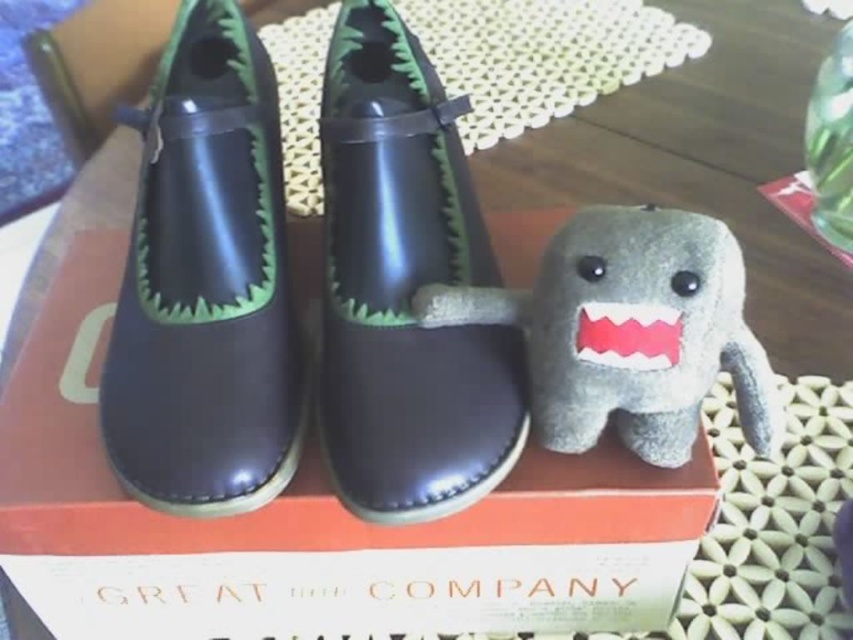
You are taking a photo of the scene and want to focus on both the point at point (264, 428) and the point at point (613, 212). Which point is closer to your camera?

Point (264, 428) is further to the camera than point (613, 212), so the point at point (613, 212) is closer to the camera.

You are organizing a display for a toy store and need to place the shiny black shoe at center and the gray plush toy at center on a shelf. The shelf has limited space, and you want to ensure both items fit without overlapping. Given their sizes, which item should be placed first to maximize space efficiency?

The shiny black shoe at center is larger than the gray plush toy at center. To maximize space efficiency, place the shiny black shoe at center first, then position the gray plush toy at center next to it.

You are standing at the origin of the coordinate system in the scene. You want to move towards the point at [753,412]. Will you pass by the point at [421,156] before reaching your destination?

Point [421,156] is behind point [753,412], so yes, you will pass by point [421,156] before reaching your destination.